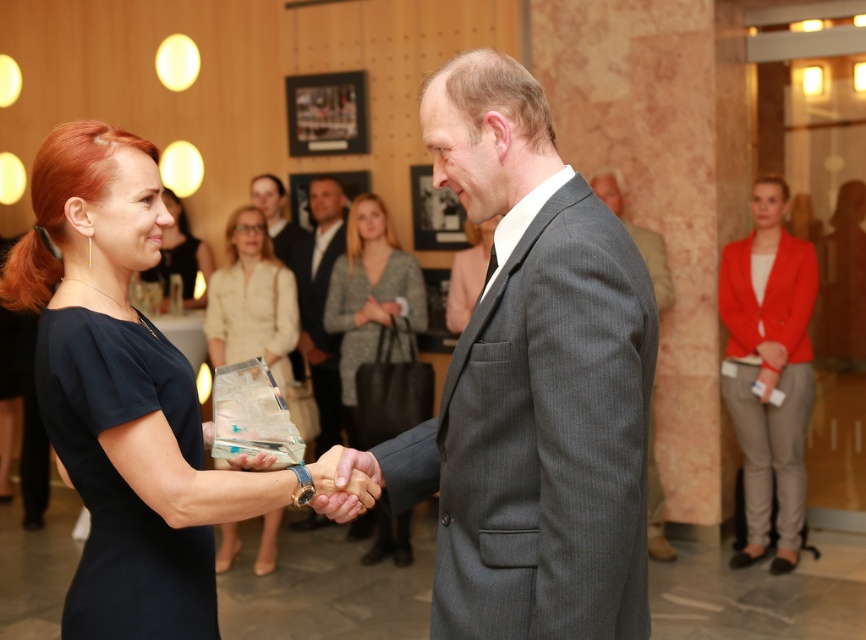
You are organizing a display case and need to know the dimensions of the transparent glass award at center and the gray suit at center. Based on the scene, can you determine if the award is wider than the gray suit?

The transparent glass award at center might be wider than gray suit at center according to the description.

You are an event planner standing at the entrance of the room. You need to ensure that the gray wool suit at center and the transparent glass award at center are within a 10 feet safety distance for crowd control. Based on the scene, are they within the required distance?

The gray wool suit at center is 11.20 feet away from the transparent glass award at center, which exceeds the 10 feet safety distance requirement. Therefore, they are not within the required distance.

You are an event photographer at a corporate event. You need to capture a photo of the gray wool suit at center and the transparent glass award at center. Based on their positions, which object is closer to the camera?

The gray wool suit at center is positioned under the transparent glass award at center, so the transparent glass award at center is closer to the camera.